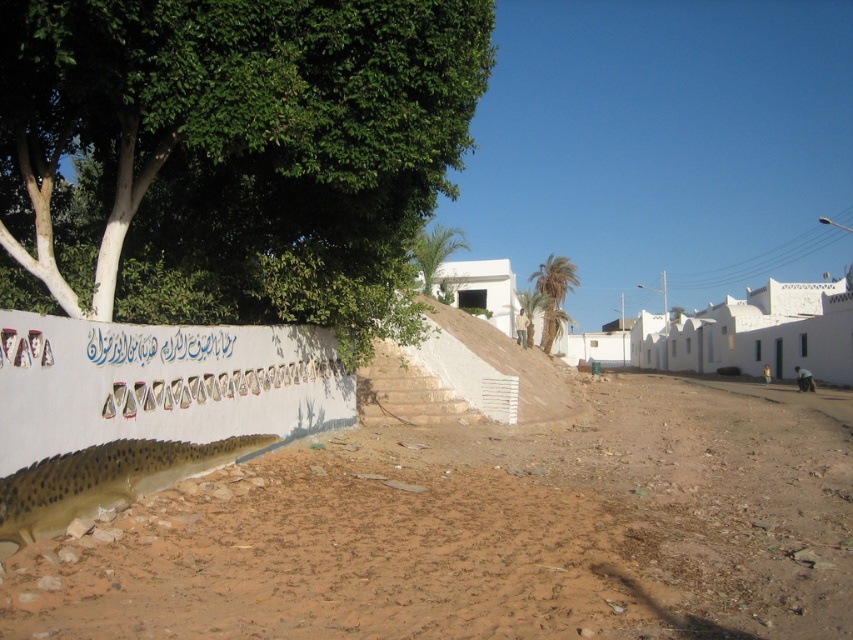
Question: Considering the real-world distances, which object is farthest from the green leafy palm tree at upper center?

Choices:
 (A) green leafy palm at center
 (B) greenish-yellow textured fish at lower left
 (C) green leafy palm tree at center
 (D) brown sandy dirt at lower center

Answer: (A)

Question: Observing the image, what is the correct spatial positioning of green leafy tree at upper left in reference to green leafy palm tree at center?

Choices:
 (A) right
 (B) left

Answer: (B)

Question: From the image, what is the correct spatial relationship of green leafy tree at upper left in relation to greenish-yellow textured fish at lower left?

Choices:
 (A) right
 (B) left

Answer: (B)

Question: Based on their relative distances, which object is farther from the green leafy tree at upper left?

Choices:
 (A) brown sandy dirt at lower center
 (B) green leafy palm tree at center

Answer: (B)

Question: From the image, what is the correct spatial relationship of green leafy palm tree at upper center in relation to green leafy palm tree at center?

Choices:
 (A) above
 (B) below

Answer: (A)

Question: Which of the following is the closest to the observer?

Choices:
 (A) (222, 440)
 (B) (544, 336)

Answer: (A)